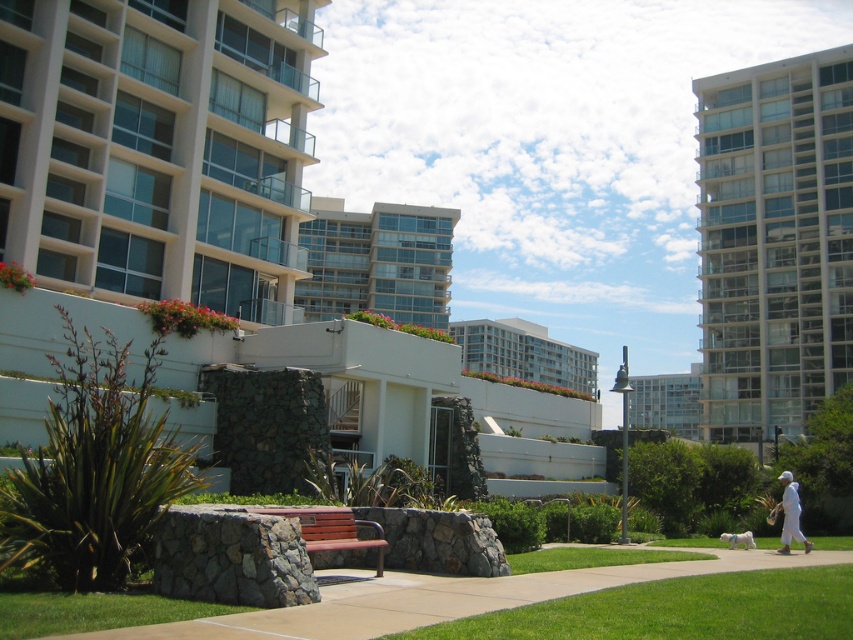
You are standing at the point marked by the coordinates point (677, 611) in the image. Based on the scene description, what would you most likely see directly below you?

The point (677, 611) indicates green grass at lower center, so you would most likely see green grass directly below you.

You are a delivery person trying to park your bike. You see the concrete pavement at center and the white glossy building at center. Which one is a better spot to park your bike?

The concrete pavement at center is located below the white glossy building at center, so it is more accessible and level, making it a better spot to park your bike.

Based on the photo, you are standing at the edge of the landscaped area in the urban setting. You see the green grass at lower center and the white matte person at lower right. Which object is closer to you?

The green grass at lower center is smaller than the white matte person at lower right, so it is closer to you.